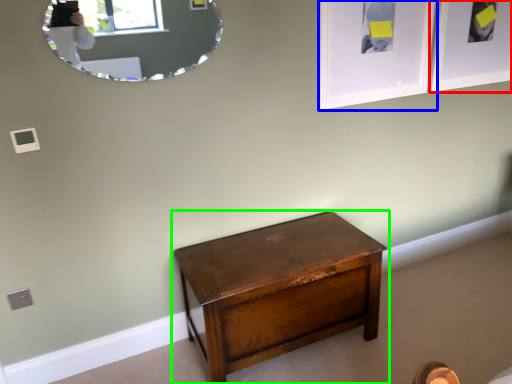
Question: Which object is positioned closest to picture frame (highlighted by a red box)? Select from picture frame (highlighted by a blue box) and nightstand (highlighted by a green box).

Choices:
 (A) picture frame
 (B) nightstand

Answer: (A)